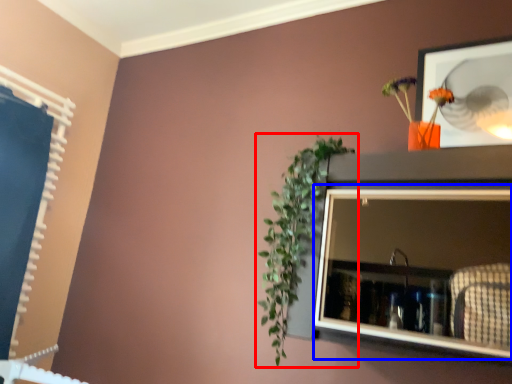
Question: Among these objects, which one is nearest to the camera, houseplant (highlighted by a red box) or medicine cabinet (highlighted by a blue box)?

Choices:
 (A) houseplant
 (B) medicine cabinet

Answer: (B)